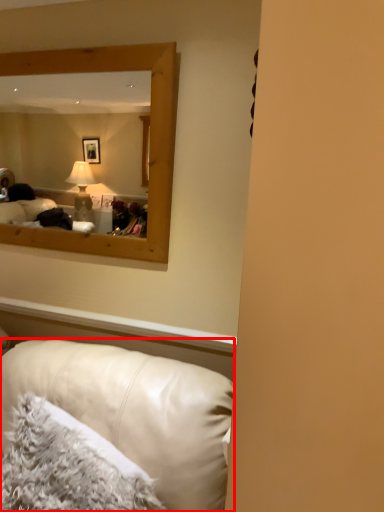
Question: Considering the relative positions of studio couch (annotated by the red box) and pillow in the image provided, where is studio couch (annotated by the red box) located with respect to the staircase?

Choices:
 (A) right
 (B) left

Answer: (B)